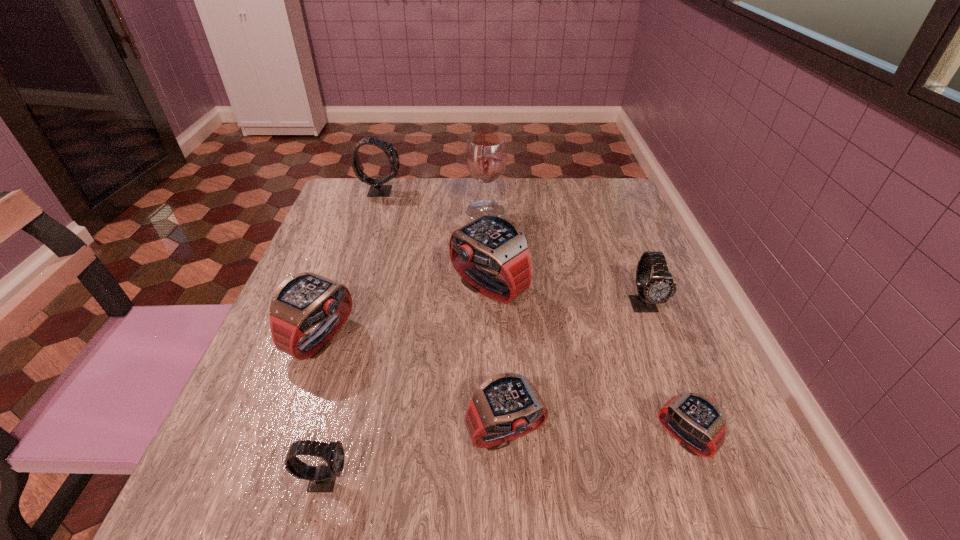
The height and width of the screenshot is (540, 960). What are the coordinates of `free space at the near left corner of the desktop` in the screenshot? It's located at (284, 465).

Identify the location of free space at the far right corner of the desktop. (583, 185).

In the image, there is a desktop. Where is `vacant space at the near right corner`? The height and width of the screenshot is (540, 960). vacant space at the near right corner is located at coordinates (755, 474).

I want to click on unoccupied position between the leftmost red watch and the nearest gray watch, so click(324, 408).

The width and height of the screenshot is (960, 540). I want to click on vacant space in between the second smallest red watch and the wineglass, so click(x=495, y=323).

What are the coordinates of `vacant area that lies between the second smallest red watch and the seventh nearest object` in the screenshot? It's located at (495, 323).

At what (x,y) coordinates should I click in order to perform the action: click on unoccupied position between the red wineglass and the farthest gray watch. Please return your answer as a coordinate pair (x, y). This screenshot has width=960, height=540. Looking at the image, I should click on (433, 201).

Locate an element on the screen. This screenshot has width=960, height=540. free space between the nearest gray watch and the second smallest red watch is located at coordinates (415, 457).

The height and width of the screenshot is (540, 960). I want to click on vacant point located between the third smallest red watch and the nearest gray watch, so click(x=324, y=408).

Where is `unoccupied area between the farthest object and the smallest gray watch`? The width and height of the screenshot is (960, 540). unoccupied area between the farthest object and the smallest gray watch is located at coordinates (352, 335).